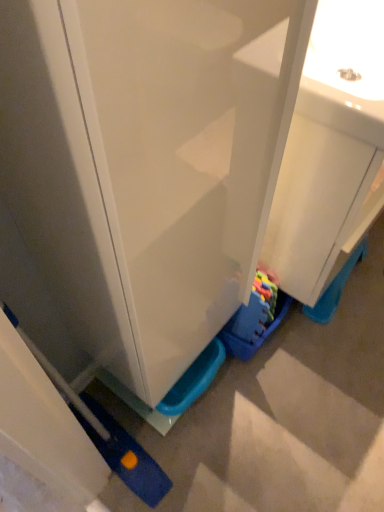
Locate an element on the screen. Image resolution: width=384 pixels, height=512 pixels. white glossy sink at center is located at coordinates (329, 149).

The image size is (384, 512). What do you see at coordinates (329, 149) in the screenshot?
I see `white glossy sink at center` at bounding box center [329, 149].

This screenshot has height=512, width=384. What do you see at coordinates (259, 337) in the screenshot? I see `rubberized plastic toy at lower center` at bounding box center [259, 337].

What is the approximate width of matte white cabinet at center?

3.37 inches.

This screenshot has height=512, width=384. Identify the location of white glossy sink at center. (329, 149).

In terms of height, does white glossy sink at center look taller or shorter compared to matte white cabinet at center?

Considering their sizes, white glossy sink at center has less height than matte white cabinet at center.

Looking at their sizes, would you say white glossy sink at center is wider or thinner than matte white cabinet at center?

In the image, white glossy sink at center appears to be wider than matte white cabinet at center.

From a real-world perspective, who is located lower, white glossy sink at center or matte white cabinet at center?

white glossy sink at center, from a real-world perspective.

The image size is (384, 512). What are the coordinates of `sink above the matte white cabinet at center (from the image's perspective)` in the screenshot? It's located at (329, 149).

Is point (290, 260) positioned before point (276, 327)?

That is True.

Is white glossy sink at center not inside rubberized plastic toy at lower center?

Absolutely, white glossy sink at center is external to rubberized plastic toy at lower center.

Considering the sizes of white glossy sink at center and rubberized plastic toy at lower center in the image, is white glossy sink at center taller or shorter than rubberized plastic toy at lower center?

Clearly, white glossy sink at center is taller compared to rubberized plastic toy at lower center.

Considering the positions of objects white glossy sink at center and rubberized plastic toy at lower center in the image provided, who is in front, white glossy sink at center or rubberized plastic toy at lower center?

white glossy sink at center is in front.

Identify the location of sink lying in front of the rubberized plastic toy at lower center. The image size is (384, 512). click(329, 149).

Does rubberized plastic toy at lower center turn towards white glossy sink at center?

No.

From a real-world perspective, does rubberized plastic toy at lower center sit lower than white glossy sink at center?

Yes, from a real-world perspective, rubberized plastic toy at lower center is under white glossy sink at center.

Considering the positions of points (277, 307) and (323, 57), is point (277, 307) closer to camera compared to point (323, 57)?

No, (277, 307) is further to viewer.

Is point (233, 293) positioned before point (295, 119)?

No, it is not.

Is matte white cabinet at center further to camera compared to white glossy sink at center?

No.

Looking at their sizes, would you say matte white cabinet at center is wider or thinner than white glossy sink at center?

matte white cabinet at center is thinner than white glossy sink at center.

Considering the positions of objects matte white cabinet at center and white glossy sink at center in the image provided, who is more to the right, matte white cabinet at center or white glossy sink at center?

white glossy sink at center.

Which object is more forward, matte white cabinet at center or rubberized plastic toy at lower center?

matte white cabinet at center is more forward.

Between matte white cabinet at center and rubberized plastic toy at lower center, which one has smaller width?

With smaller width is matte white cabinet at center.

From the image's perspective, is matte white cabinet at center located above or below rubberized plastic toy at lower center?

matte white cabinet at center is situated lower than rubberized plastic toy at lower center in the image.

I want to click on toy above the matte white cabinet at center (from the image's perspective), so click(259, 337).

Considering the relative sizes of rubberized plastic toy at lower center and matte white cabinet at center in the image provided, is rubberized plastic toy at lower center thinner than matte white cabinet at center?

No, rubberized plastic toy at lower center is not thinner than matte white cabinet at center.

Can you confirm if rubberized plastic toy at lower center is shorter than matte white cabinet at center?

Yes, rubberized plastic toy at lower center is shorter than matte white cabinet at center.

In the image, is rubberized plastic toy at lower center on the left side or the right side of matte white cabinet at center?

In the image, rubberized plastic toy at lower center appears on the right side of matte white cabinet at center.

Find the location of a particular element. cabinetry in front of the white glossy sink at center is located at coordinates (140, 170).

Find the location of a particular element. The height and width of the screenshot is (512, 384). sink located on the right of rubberized plastic toy at lower center is located at coordinates (329, 149).

Considering their positions, is matte white cabinet at center positioned closer to white glossy sink at center than rubberized plastic toy at lower center?

Based on the image, matte white cabinet at center appears to be nearer to white glossy sink at center.

When comparing their distances from rubberized plastic toy at lower center, does white glossy sink at center or matte white cabinet at center seem further?

matte white cabinet at center is positioned further to the anchor rubberized plastic toy at lower center.

In the scene shown: When comparing their distances from rubberized plastic toy at lower center, does matte white cabinet at center or white glossy sink at center seem closer?

The object closer to rubberized plastic toy at lower center is white glossy sink at center.

Looking at the image, which one is located closer to matte white cabinet at center, white glossy sink at center or rubberized plastic toy at lower center?

The object closer to matte white cabinet at center is white glossy sink at center.

Considering their positions, is rubberized plastic toy at lower center positioned further to white glossy sink at center than matte white cabinet at center?

rubberized plastic toy at lower center is positioned further to the anchor white glossy sink at center.

Which object lies further to the anchor point matte white cabinet at center, rubberized plastic toy at lower center or white glossy sink at center?

Based on the image, rubberized plastic toy at lower center appears to be further to matte white cabinet at center.

In order to click on sink between matte white cabinet at center and rubberized plastic toy at lower center along the z-axis in this screenshot , I will do `click(329, 149)`.